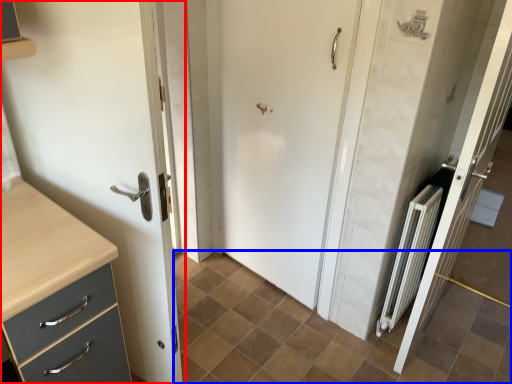
Question: Which object appears closest to the camera in this image, door (highlighted by a red box) or ceramic tile (highlighted by a blue box)?

Choices:
 (A) door
 (B) ceramic tile

Answer: (A)